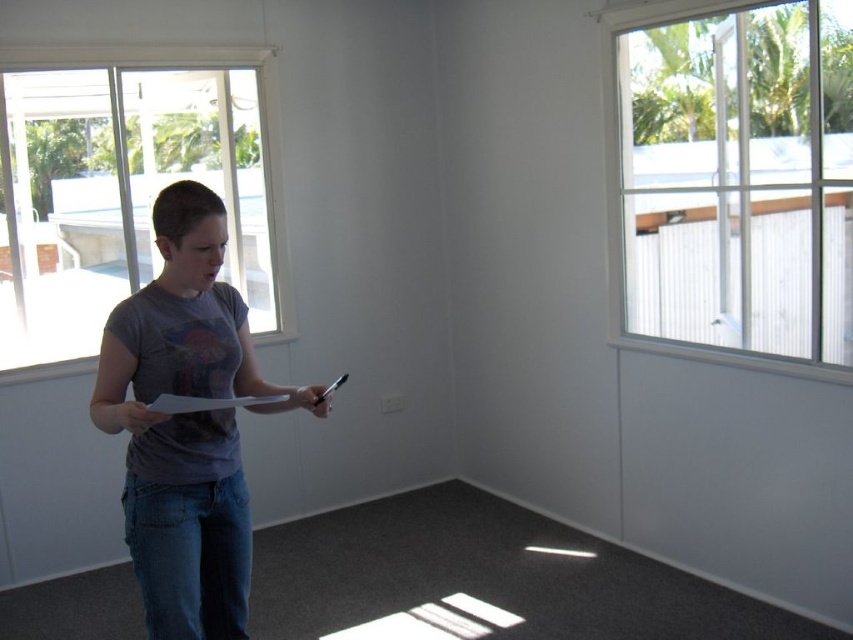
Question: Based on their relative distances, which object is farther from the white paper clipboard at center?

Choices:
 (A) clear glass window at upper right
 (B) gray t-shirt at center
 (C) clear glass window at left

Answer: (A)

Question: Which object appears closest to the camera in this image?

Choices:
 (A) clear glass window at upper right
 (B) white paper clipboard at center
 (C) gray t-shirt at center
 (D) clear glass window at left

Answer: (B)

Question: Does clear glass window at left appear on the right side of white paper clipboard at center?

Choices:
 (A) yes
 (B) no

Answer: (B)

Question: Is clear glass window at left to the right of gray t-shirt at center from the viewer's perspective?

Choices:
 (A) yes
 (B) no

Answer: (B)

Question: Which object is farther from the camera taking this photo?

Choices:
 (A) gray t-shirt at center
 (B) white paper clipboard at center
 (C) clear glass window at left

Answer: (C)

Question: Can you confirm if clear glass window at upper right is thinner than white paper clipboard at center?

Choices:
 (A) no
 (B) yes

Answer: (A)